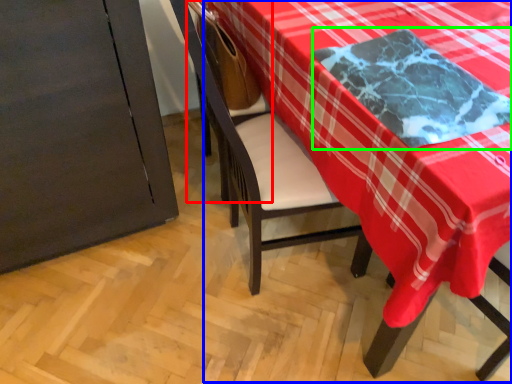
Question: Which is farther away from armchair (highlighted by a red box)? table (highlighted by a blue box) or cloth (highlighted by a green box)?

Choices:
 (A) table
 (B) cloth

Answer: (B)